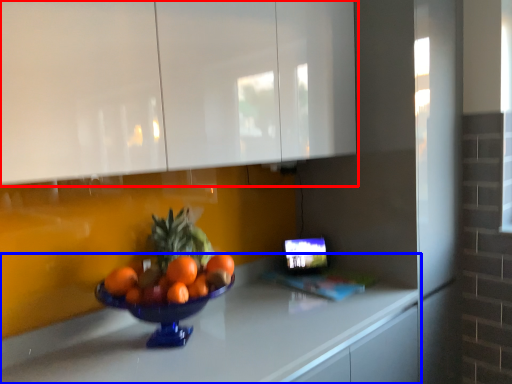
Question: Which object is closer to the camera taking this photo, cabinetry (highlighted by a red box) or countertop (highlighted by a blue box)?

Choices:
 (A) cabinetry
 (B) countertop

Answer: (B)